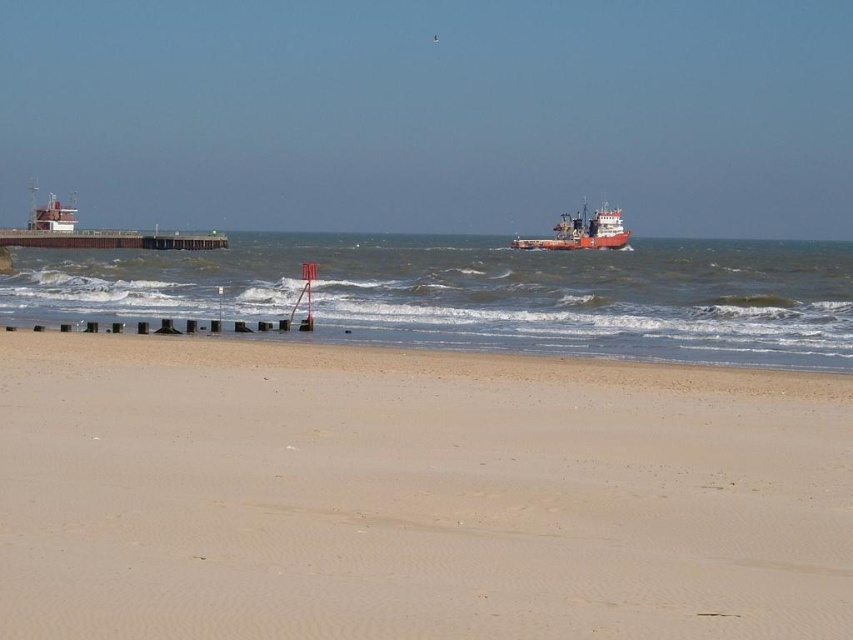
Question: Which point is farther to the camera?

Choices:
 (A) brown sandy water at center
 (B) beige sandy beach at lower center
 (C) wooden dock at left

Answer: (C)

Question: Does wooden dock at left have a greater width compared to red matte ship at center?

Choices:
 (A) yes
 (B) no

Answer: (B)

Question: Which object appears closest to the camera in this image?

Choices:
 (A) wooden dock at left
 (B) beige sandy beach at lower center
 (C) brown sandy water at center
 (D) red matte ship at center

Answer: (B)

Question: Is wooden dock at left bigger than red matte ship at center?

Choices:
 (A) no
 (B) yes

Answer: (A)

Question: Does beige sandy beach at lower center appear on the left side of brown sandy water at center?

Choices:
 (A) yes
 (B) no

Answer: (A)

Question: Among these points, which one is nearest to the camera?

Choices:
 (A) (262, 259)
 (B) (144, 445)
 (C) (192, 237)

Answer: (B)